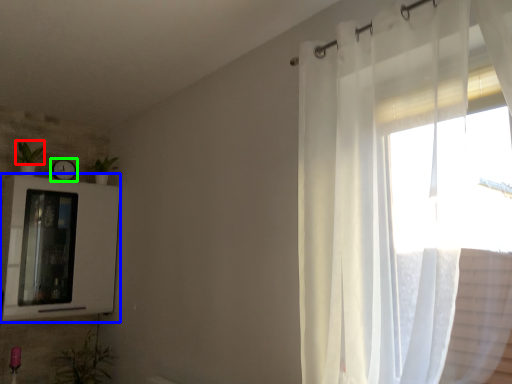
Question: Which object is positioned farthest from plant (highlighted by a red box)? Select from medicine cabinet (highlighted by a blue box) and clock (highlighted by a green box).

Choices:
 (A) medicine cabinet
 (B) clock

Answer: (A)